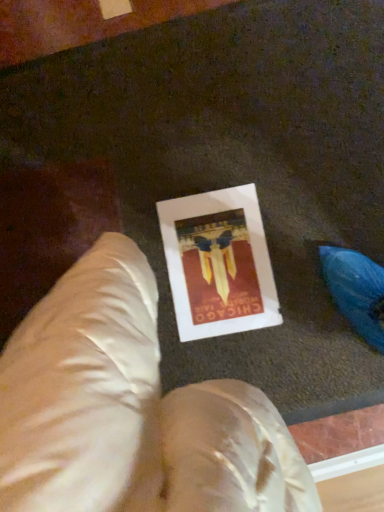
Question: Is point (175, 266) closer or farther from the camera than point (221, 406)?

Choices:
 (A) closer
 (B) farther

Answer: (B)

Question: From a real-world perspective, is white paper at center physically located above or below satin beige bean bag chair at center?

Choices:
 (A) below
 (B) above

Answer: (A)

Question: In terms of height, does white paper at center look taller or shorter compared to satin beige bean bag chair at center?

Choices:
 (A) short
 (B) tall

Answer: (A)

Question: Based on their sizes in the image, would you say satin beige bean bag chair at center is bigger or smaller than white paper at center?

Choices:
 (A) small
 (B) big

Answer: (B)

Question: Is satin beige bean bag chair at center to the left or to the right of white paper at center in the image?

Choices:
 (A) right
 (B) left

Answer: (B)

Question: Is satin beige bean bag chair at center in front of or behind white paper at center in the image?

Choices:
 (A) front
 (B) behind

Answer: (A)

Question: Is satin beige bean bag chair at center inside the boundaries of white paper at center, or outside?

Choices:
 (A) outside
 (B) inside

Answer: (A)